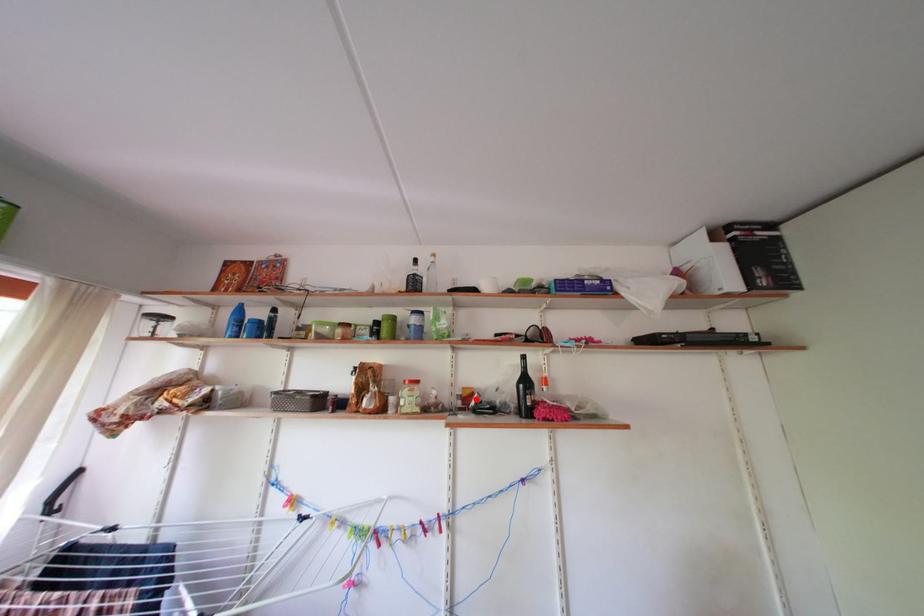
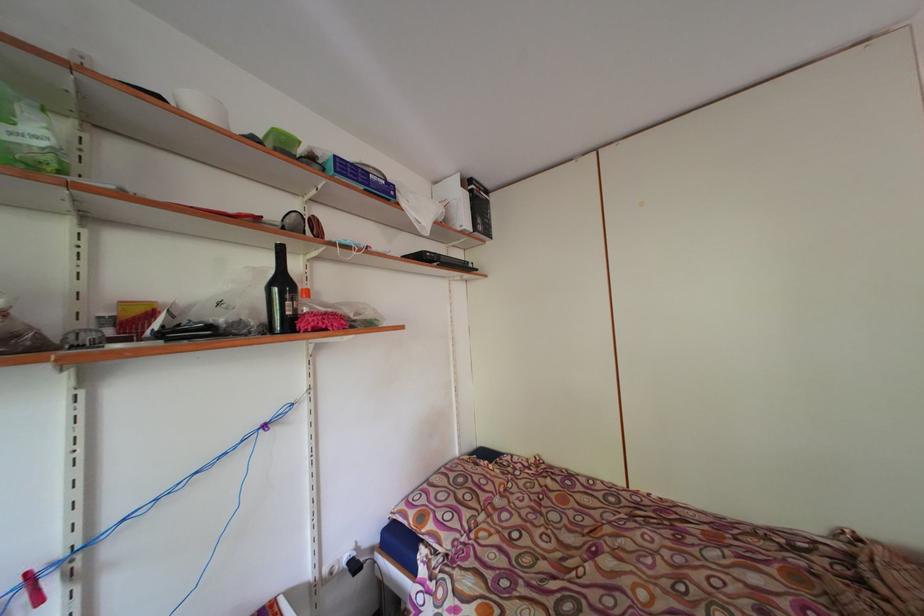
In the second image, find the point that corresponds to the highlighted location in the first image.

(144, 317)